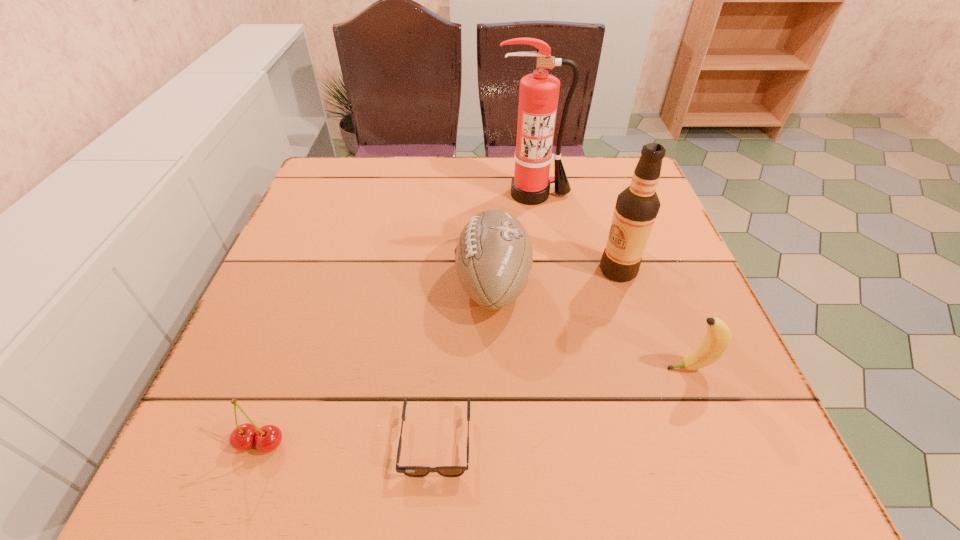
Identify the location of sunglasses positioned at the near edge. (412, 471).

I want to click on object present at the left edge, so click(x=267, y=438).

The height and width of the screenshot is (540, 960). I want to click on alcohol that is positioned at the right edge, so click(636, 209).

In order to click on banana that is at the right edge in this screenshot , I will do `click(718, 337)`.

Image resolution: width=960 pixels, height=540 pixels. Find the location of `object situated at the near left corner`. object situated at the near left corner is located at coordinates (267, 438).

Locate an element on the screen. The width and height of the screenshot is (960, 540). vacant region at the far edge of the desktop is located at coordinates (497, 160).

Locate an element on the screen. vacant space at the near edge of the desktop is located at coordinates [633, 477].

At what (x,y) coordinates should I click in order to perform the action: click on free space at the left edge of the desktop. Please return your answer as a coordinate pair (x, y). Looking at the image, I should click on (311, 346).

Find the location of a particular element. vacant space at the far left corner is located at coordinates (x=324, y=192).

The image size is (960, 540). In the image, there is a desktop. Identify the location of free region at the far right corner. (598, 167).